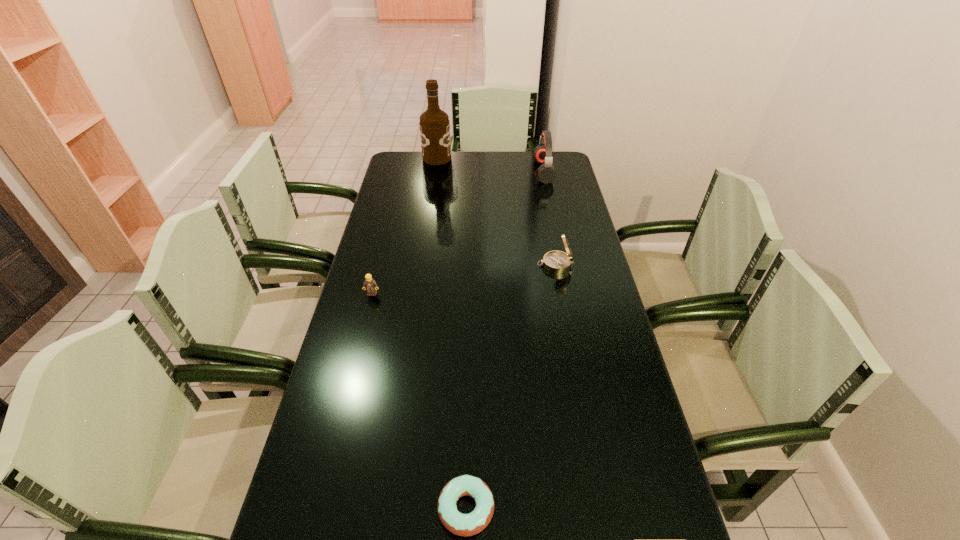
Identify the location of free region at the far right corner. (555, 163).

Where is `vacant space that is in between the tallest object and the second shortest object`? The height and width of the screenshot is (540, 960). vacant space that is in between the tallest object and the second shortest object is located at coordinates (404, 226).

Locate an element on the screen. blank region between the earphone and the fourth farthest object is located at coordinates (458, 232).

The height and width of the screenshot is (540, 960). Identify the location of vacant point located between the third farthest object and the tallest object. (496, 211).

The height and width of the screenshot is (540, 960). In order to click on free area in between the nearest object and the tallest object in this screenshot , I will do `click(451, 333)`.

Where is `free point between the second tallest object and the Lego`? free point between the second tallest object and the Lego is located at coordinates (458, 232).

I want to click on blank region between the second object from left to right and the Lego, so click(404, 226).

The height and width of the screenshot is (540, 960). In order to click on free space between the doughnut and the earphone in this screenshot , I will do `click(505, 340)`.

Where is `free space between the fourth shortest object and the third object from left to right`? The image size is (960, 540). free space between the fourth shortest object and the third object from left to right is located at coordinates (505, 340).

You are a GUI agent. You are given a task and a screenshot of the screen. Output one action in this format:
    pyautogui.click(x=<x>, y=<y>)
    Task: Click on the vacant area between the third nearest object and the alcohol
    
    Given the screenshot: What is the action you would take?
    pyautogui.click(x=496, y=211)